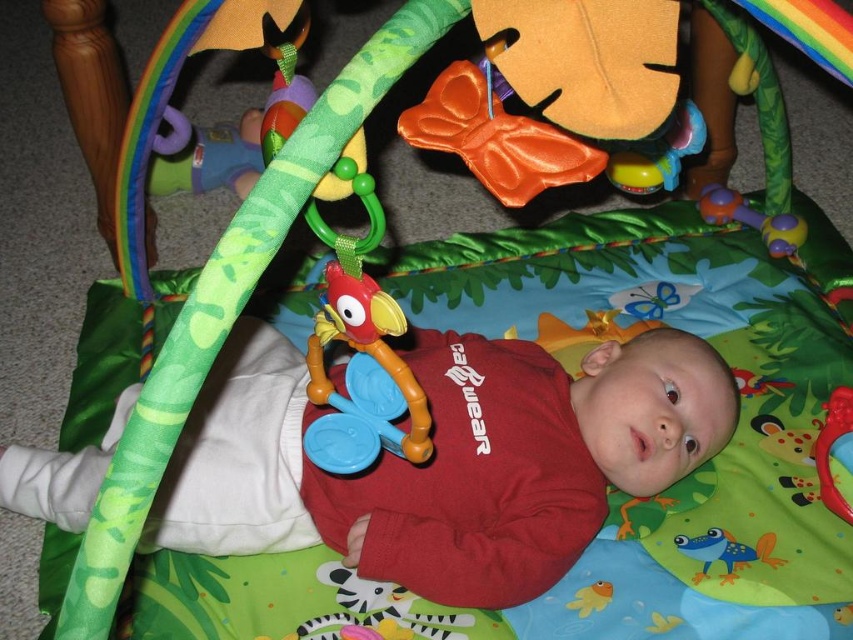
Question: Which object appears farthest from the camera in this image?

Choices:
 (A) rubberized blue teether at upper left
 (B) shiny orange bow at upper center

Answer: (A)

Question: Which of the following is the closest to the observer?

Choices:
 (A) rubberized plastic bird at center
 (B) rubberized blue teether at upper left

Answer: (A)

Question: Can you confirm if shiny orange bow at upper center is wider than rubberized blue teether at upper left?

Choices:
 (A) no
 (B) yes

Answer: (A)

Question: From the image, what is the correct spatial relationship of shiny orange bow at upper center in relation to rubberized purple rattle at upper right?

Choices:
 (A) above
 (B) below

Answer: (B)

Question: Considering the real-world distances, which object is farthest from the rubberized plastic bird at center?

Choices:
 (A) rubberized blue teether at upper left
 (B) shiny orange bow at upper center

Answer: (A)

Question: Does rubberized plastic bird at center have a lesser width compared to rubberized blue teether at upper left?

Choices:
 (A) no
 (B) yes

Answer: (B)